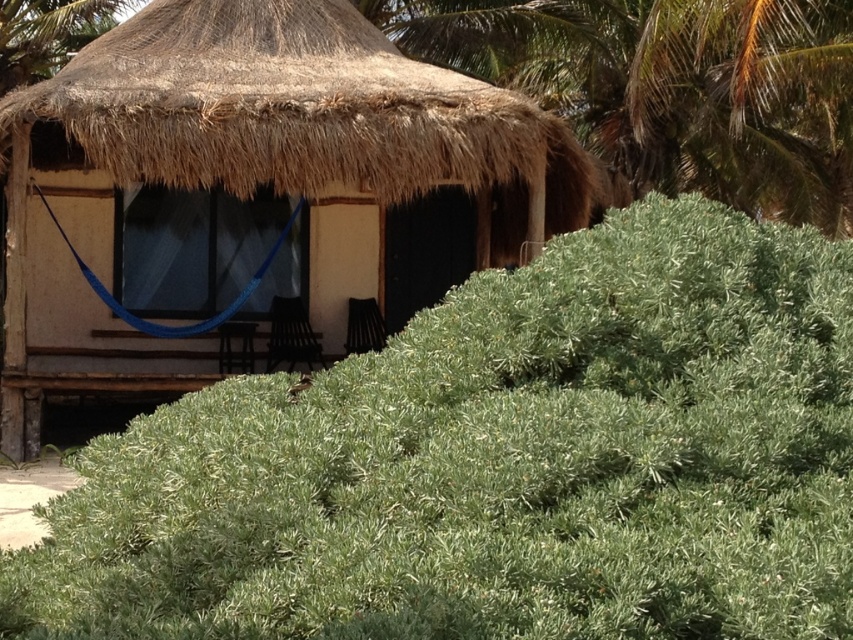
Question: Which object is the closest to the brown thatch roof at upper center?

Choices:
 (A) green leafy palm tree at upper right
 (B) thatched roof hut at center
 (C) green leafy hedge at lower center

Answer: (B)

Question: Can you confirm if thatched roof hut at center is positioned to the right of green leafy palm tree at upper right?

Choices:
 (A) yes
 (B) no

Answer: (B)

Question: Observing the image, what is the correct spatial positioning of thatched roof hut at center in reference to brown thatch roof at upper center?

Choices:
 (A) above
 (B) below

Answer: (B)

Question: Which object is closer to the camera taking this photo?

Choices:
 (A) thatched roof hut at center
 (B) brown thatch roof at upper center
 (C) green leafy hedge at lower center

Answer: (C)

Question: Which point is closer to the camera?

Choices:
 (A) green leafy palm tree at upper right
 (B) brown thatch roof at upper center

Answer: (B)

Question: Can you confirm if green leafy hedge at lower center is smaller than thatched roof hut at center?

Choices:
 (A) no
 (B) yes

Answer: (A)